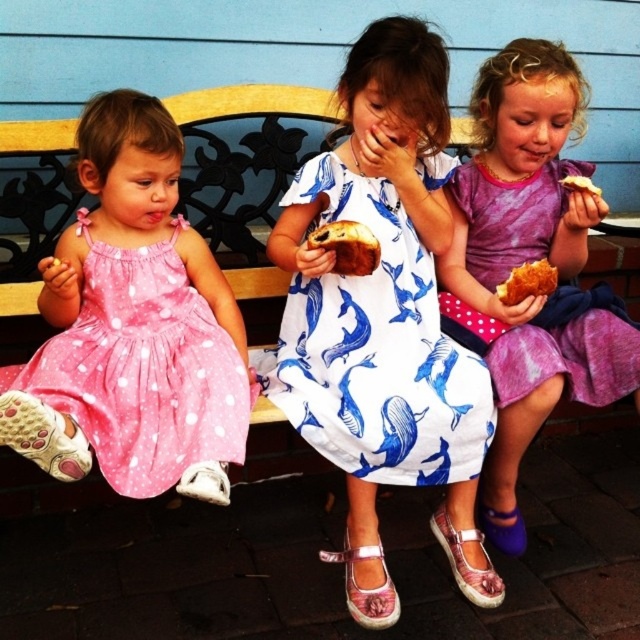
You are a parent trying to decide which snack to give your child. You see both the golden crispy bread at center and the golden crispy pastry at center. Which one is located below the other?

The golden crispy bread at center is positioned under the golden crispy pastry at center.